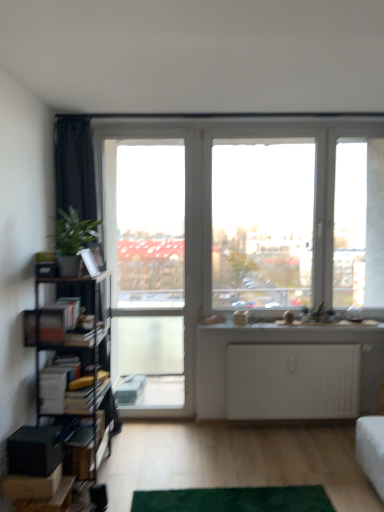
Question: From the image's perspective, is transparent glass window at center on clear glass screen door at center?

Choices:
 (A) yes
 (B) no

Answer: (A)

Question: Is transparent glass window at center far from clear glass screen door at center?

Choices:
 (A) yes
 (B) no

Answer: (A)

Question: Is transparent glass window at center surrounding clear glass screen door at center?

Choices:
 (A) no
 (B) yes

Answer: (A)

Question: Does transparent glass window at center turn towards clear glass screen door at center?

Choices:
 (A) no
 (B) yes

Answer: (A)

Question: Is transparent glass window at center to the right of clear glass screen door at center from the viewer's perspective?

Choices:
 (A) no
 (B) yes

Answer: (B)

Question: From their relative heights in the image, would you say green carpet at lower center is taller or shorter than hardcover books at left, the 1th book when ordered from top to bottom?

Choices:
 (A) short
 (B) tall

Answer: (A)

Question: From a real-world perspective, is green carpet at lower center physically located above or below hardcover books at left, marked as the 2th book in a bottom-to-top arrangement?

Choices:
 (A) below
 (B) above

Answer: (A)

Question: Considering the positions of green carpet at lower center and hardcover books at left, marked as the 2th book in a bottom-to-top arrangement, in the image, is green carpet at lower center bigger or smaller than hardcover books at left, marked as the 2th book in a bottom-to-top arrangement,?

Choices:
 (A) big
 (B) small

Answer: (B)

Question: Is green carpet at lower center in front of or behind hardcover books at left, the 1th book when ordered from top to bottom, in the image?

Choices:
 (A) front
 (B) behind

Answer: (A)

Question: Considering their positions, is green carpet at lower center located in front of or behind metallic black bookshelf at left?

Choices:
 (A) behind
 (B) front

Answer: (B)

Question: From a real-world perspective, is green carpet at lower center positioned above or below metallic black bookshelf at left?

Choices:
 (A) above
 (B) below

Answer: (B)

Question: Choose the correct answer: Is green carpet at lower center inside metallic black bookshelf at left or outside it?

Choices:
 (A) outside
 (B) inside

Answer: (A)

Question: Looking at their shapes, would you say green carpet at lower center is wider or thinner than metallic black bookshelf at left?

Choices:
 (A) wide
 (B) thin

Answer: (B)

Question: Is transparent glass window at center bigger or smaller than hardcover books at left, the second book positioned from the top?

Choices:
 (A) small
 (B) big

Answer: (B)

Question: From a real-world perspective, is transparent glass window at center positioned above or below hardcover books at left, the first book when ordered from bottom to top?

Choices:
 (A) above
 (B) below

Answer: (A)